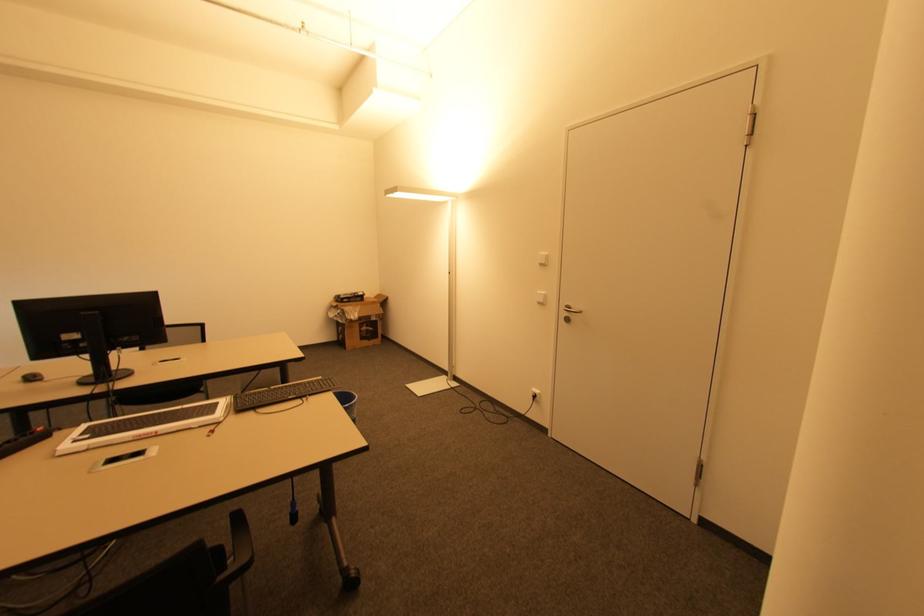
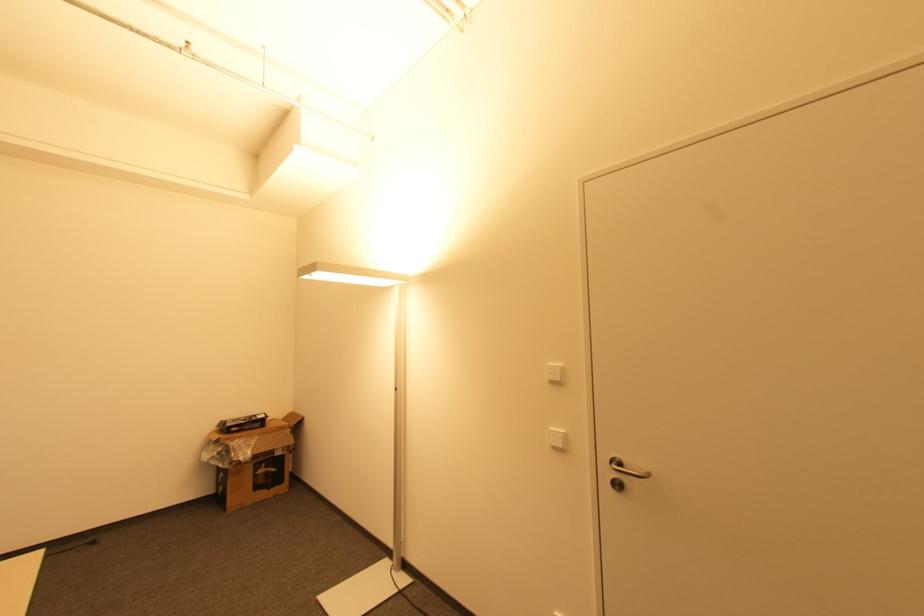
Find the pixel in the second image that matches (369,331) in the first image.

(268, 472)